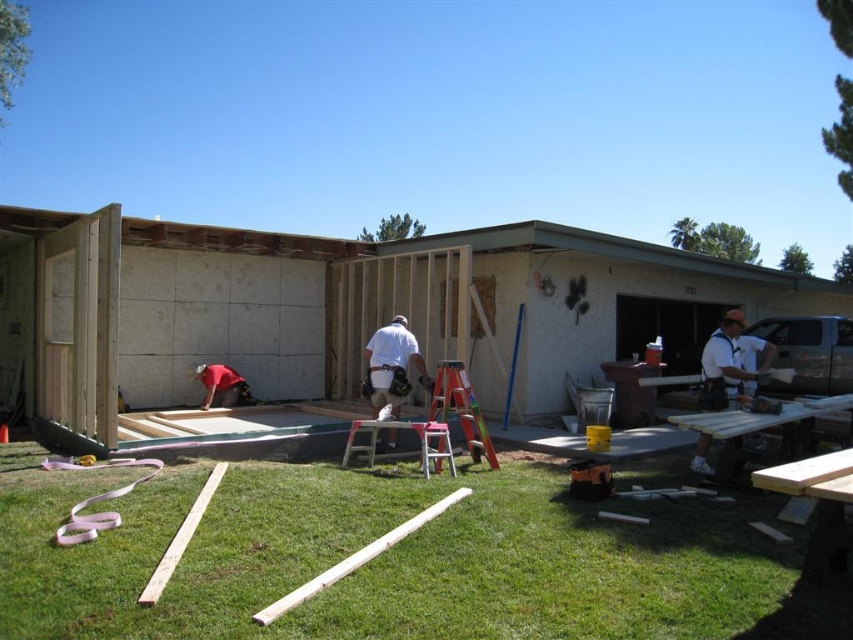
You are standing at the construction site and need to determine which of the two points, point (743, 326) or point (403, 353), is closer to you. Which one is closer?

Point (743, 326) is further to the viewer than point (403, 353), so the closer point is point (403, 353).

You are a safety inspector observing the construction site. You notice two workers in the scene. One is wearing a white matte shirt at center and another is the red fabric construction worker at lower left. Which worker appears to be closer to the red ladder leaning against the wall?

The red fabric construction worker at lower left is closer to the red ladder leaning against the wall because they are positioned at the lower left, which is near the ladder, while the white matte shirt at center is further away.